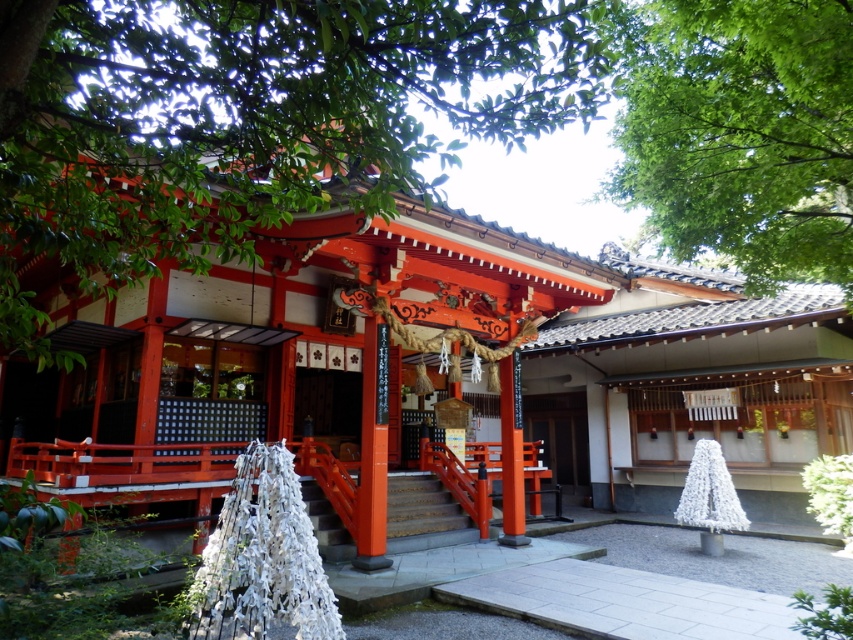
Question: Which point is closer to the camera taking this photo?

Choices:
 (A) (425, 548)
 (B) (845, 68)
 (C) (178, 8)

Answer: (B)

Question: Which point is closer to the camera?

Choices:
 (A) smooth wood stairs at center
 (B) green leafy tree at upper right
 (C) smooth wooden door at center

Answer: (B)

Question: Does green leafy tree at upper right come behind smooth wooden door at center?

Choices:
 (A) no
 (B) yes

Answer: (A)

Question: Does green leafy tree at upper left appear over green leafy tree at upper right?

Choices:
 (A) yes
 (B) no

Answer: (B)

Question: Which object is the farthest from the smooth wooden door at center?

Choices:
 (A) green leafy tree at upper right
 (B) green leafy tree at upper left
 (C) smooth wood stairs at center

Answer: (B)

Question: Is smooth wood stairs at center wider than smooth wooden door at center?

Choices:
 (A) no
 (B) yes

Answer: (A)